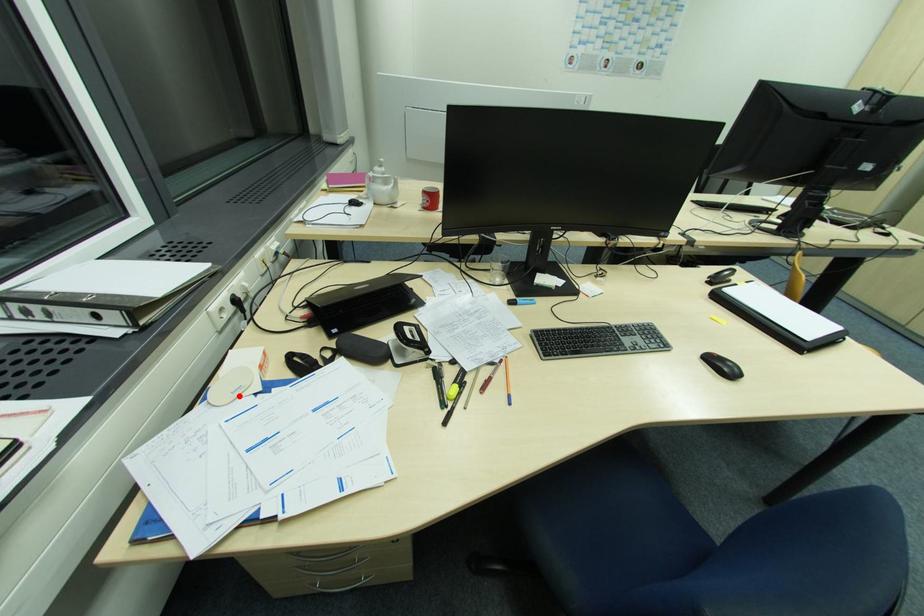
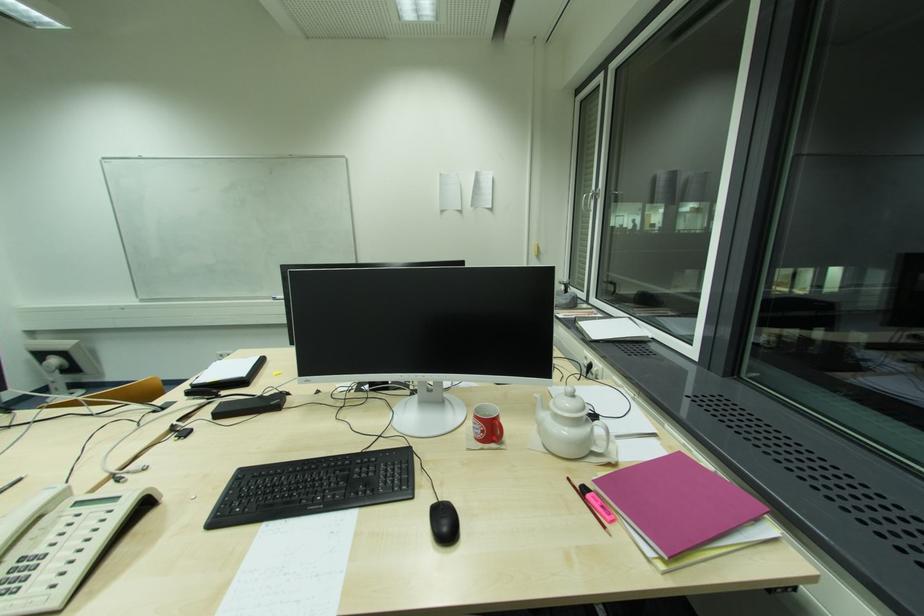
Question: I am providing you with two images of the same scene from different viewpoints. A red point is marked on the first image. Is the red point's position out of view in image 2?

Choices:
 (A) Yes
 (B) No

Answer: (A)